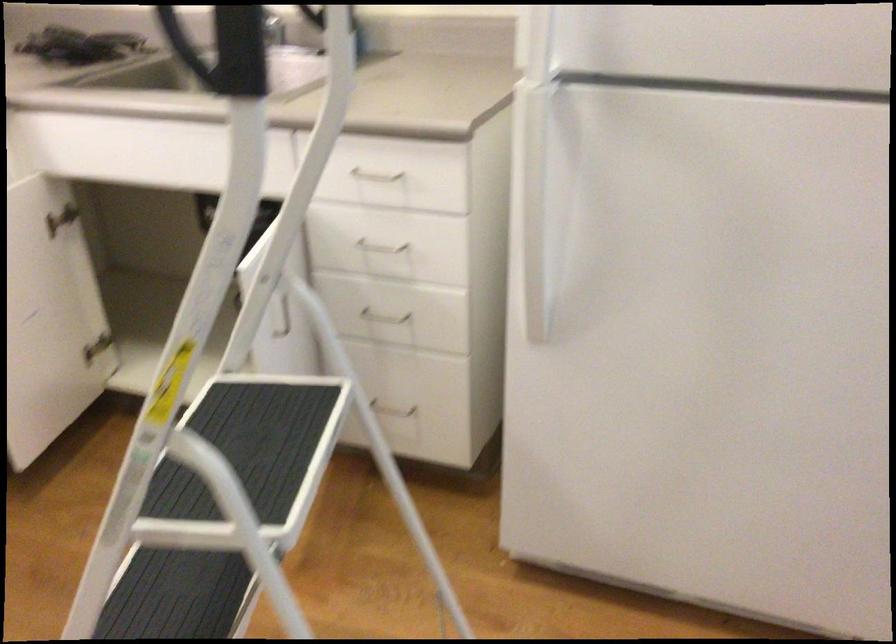
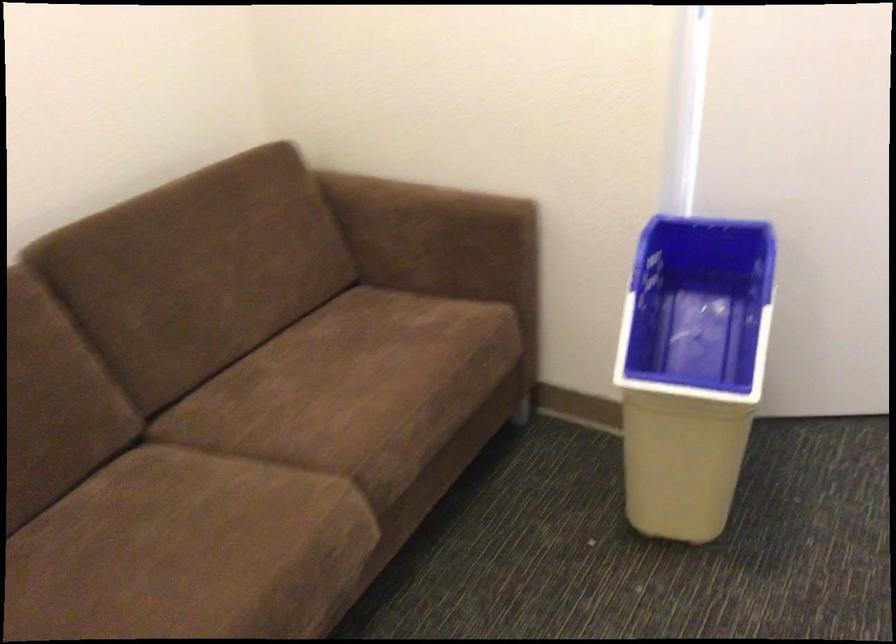
Based on the continuous images, in which direction is the camera rotating?

The camera rotated toward right-down.